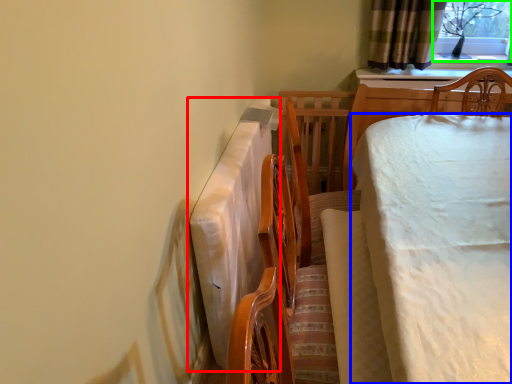
Question: Estimate the real-world distances between objects in this image. Which object is farther from tablecloth (highlighted by a red box), table (highlighted by a blue box) or window screen (highlighted by a green box)?

Choices:
 (A) table
 (B) window screen

Answer: (B)